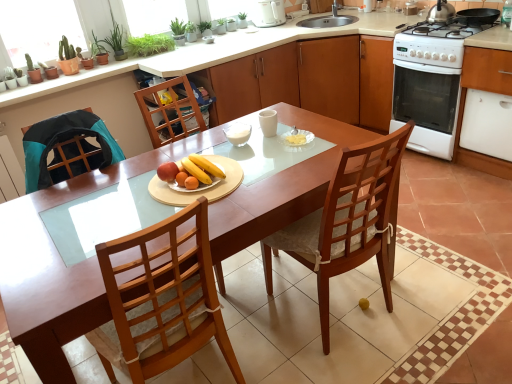
Question: Can green leafy plant at upper left be found inside wooden table at center?

Choices:
 (A) no
 (B) yes

Answer: (A)

Question: Does wooden table at center turn towards green leafy plant at upper left?

Choices:
 (A) yes
 (B) no

Answer: (B)

Question: Can you confirm if wooden table at center is smaller than green leafy plant at upper left?

Choices:
 (A) yes
 (B) no

Answer: (B)

Question: Does wooden table at center have a greater height compared to green leafy plant at upper left?

Choices:
 (A) yes
 (B) no

Answer: (A)

Question: Is wooden table at center to the left of green leafy plant at upper left from the viewer's perspective?

Choices:
 (A) no
 (B) yes

Answer: (A)

Question: Can you confirm if wooden table at center is wider than green leafy plant at upper left?

Choices:
 (A) no
 (B) yes

Answer: (B)

Question: Would you consider white glossy oven at right to be distant from white glossy electric kettle at upper center?

Choices:
 (A) no
 (B) yes

Answer: (B)

Question: Does white glossy oven at right have a greater height compared to white glossy electric kettle at upper center?

Choices:
 (A) no
 (B) yes

Answer: (B)

Question: Is white glossy oven at right not inside white glossy electric kettle at upper center?

Choices:
 (A) yes
 (B) no

Answer: (A)

Question: Is white glossy oven at right closer to the viewer compared to white glossy electric kettle at upper center?

Choices:
 (A) no
 (B) yes

Answer: (B)

Question: From a real-world perspective, is white glossy oven at right located higher than white glossy electric kettle at upper center?

Choices:
 (A) yes
 (B) no

Answer: (B)

Question: Is white glossy oven at right oriented away from white glossy electric kettle at upper center?

Choices:
 (A) yes
 (B) no

Answer: (B)

Question: Is yellow matte bananas at center, the first fruit dish from the right, oriented away from wooden cabinet at center, the second cabinetry in the right-to-left sequence?

Choices:
 (A) no
 (B) yes

Answer: (A)